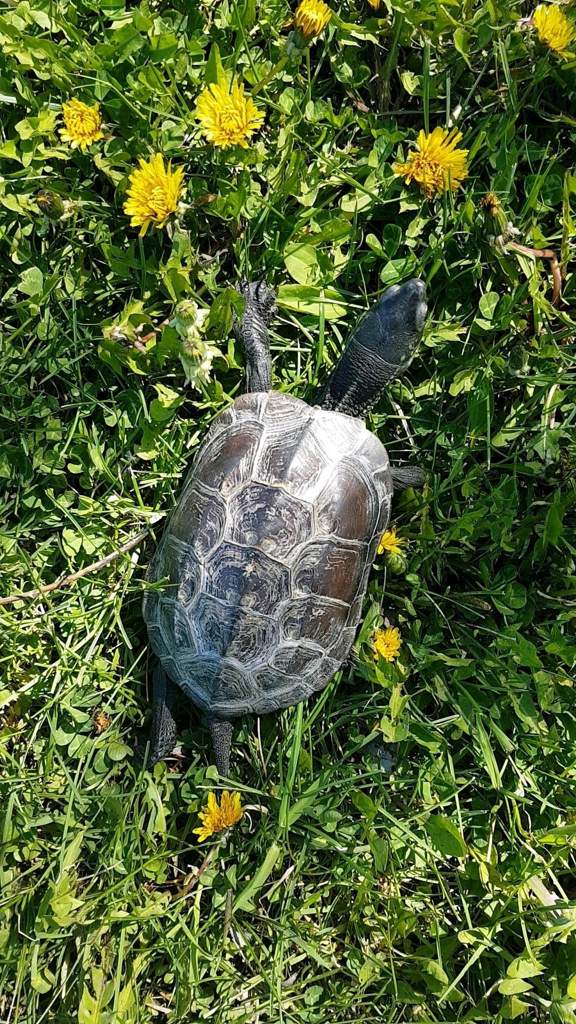
Identify the location of plant. This screenshot has height=1024, width=576. (475, 957).